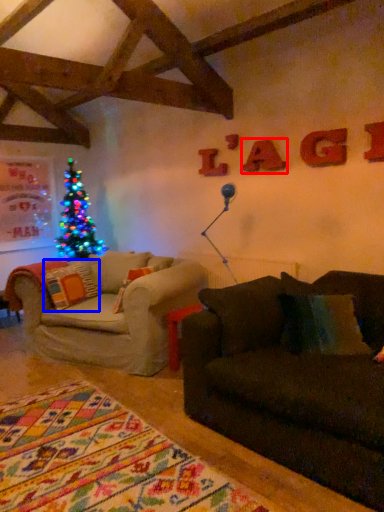
Question: Which of the following is the closest to the observer, letter (highlighted by a red box) or pillow (highlighted by a blue box)?

Choices:
 (A) letter
 (B) pillow

Answer: (A)